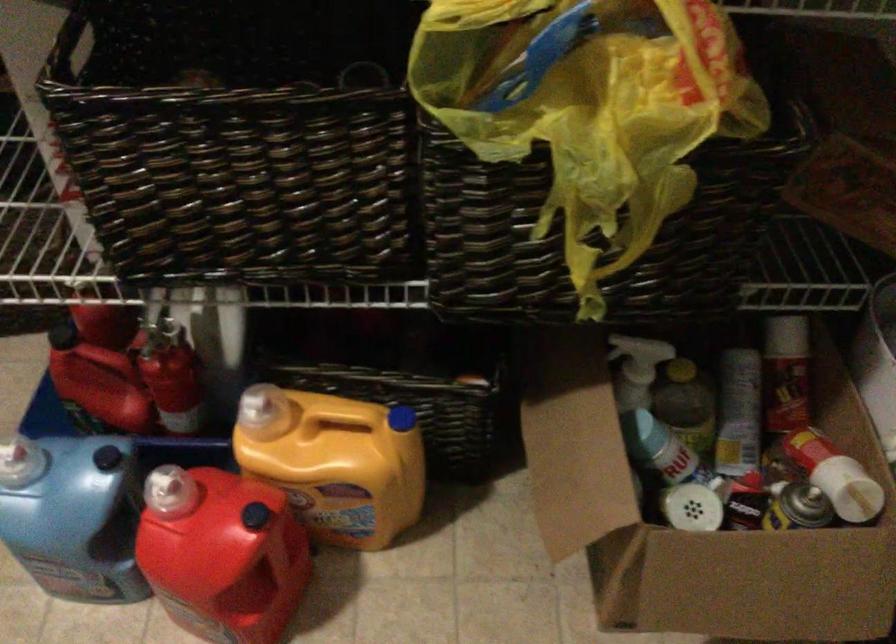
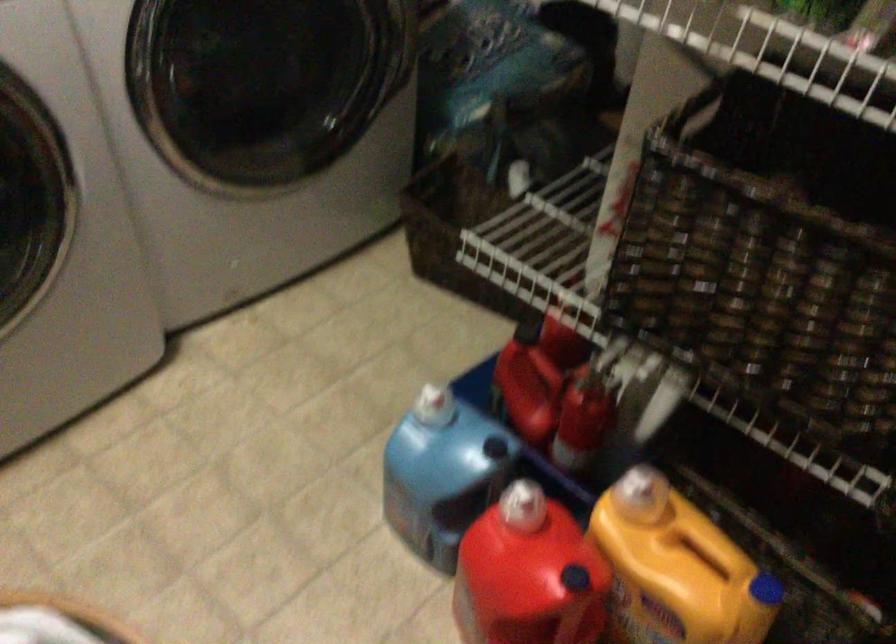
Question: The first image is from the beginning of the video and the second image is from the end. How did the camera likely rotate when shooting the video?

Choices:
 (A) Left
 (B) Right
 (C) Up
 (D) Down

Answer: (A)